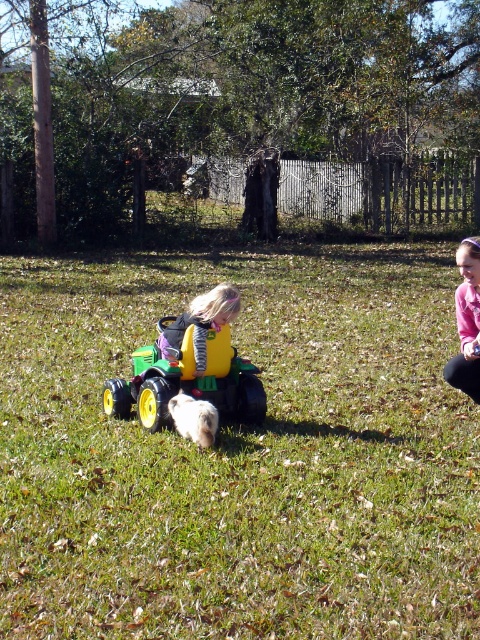
Can you confirm if green grass at center is shorter than green plastic tractor at center?

Incorrect, green grass at center's height does not fall short of green plastic tractor at center's.

From the picture: Can you confirm if green grass at center is positioned to the right of green plastic tractor at center?

Correct, you'll find green grass at center to the right of green plastic tractor at center.

Identify the location of green grass at center. (240, 454).

Who is positioned more to the left, green plastic tractor at center or matte yellow toy at center?

green plastic tractor at center is more to the left.

Which of these two, green plastic tractor at center or matte yellow toy at center, stands taller?

Standing taller between the two is green plastic tractor at center.

This screenshot has height=640, width=480. What are the coordinates of `green plastic tractor at center` in the screenshot? It's located at (188, 381).

At what (x,y) coordinates should I click in order to perform the action: click on green plastic tractor at center. Please return your answer as a coordinate pair (x, y). Looking at the image, I should click on (188, 381).

Based on the photo, measure the distance between green plastic tractor at center and camera.

They are 5.38 meters apart.

Can you confirm if green plastic tractor at center is positioned to the left of pink fleece jacket at right?

Indeed, green plastic tractor at center is positioned on the left side of pink fleece jacket at right.

Which is behind, point (238, 394) or point (463, 352)?

Point (238, 394)

Identify the location of green plastic tractor at center. (188, 381).